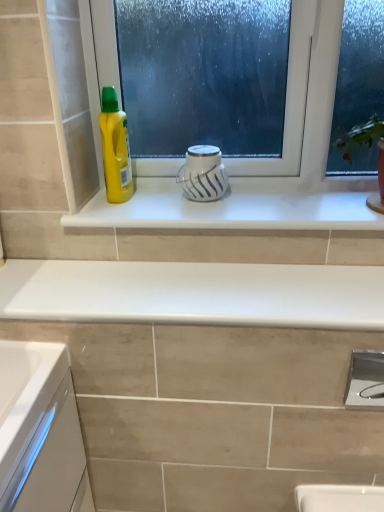
You are a GUI agent. You are given a task and a screenshot of the screen. Output one action in this format:
    pyautogui.click(x=<x>, y=<y>)
    Task: Click on the free space to the right of white glossy mug at center
    
    Given the screenshot: What is the action you would take?
    pyautogui.click(x=267, y=200)